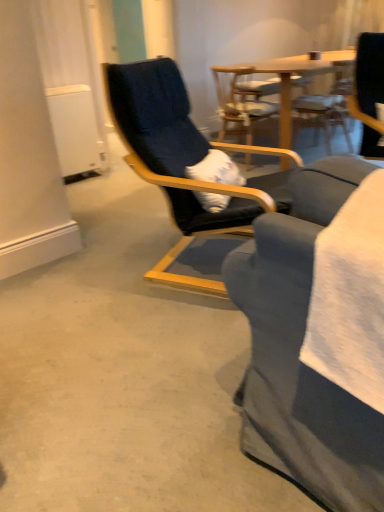
Question: Looking at their shapes, would you say wooden chair at center, the 1th chair in the back-to-front sequence, is wider or thinner than wooden chair at center, positioned as the 2th chair in back-to-front order?

Choices:
 (A) thin
 (B) wide

Answer: (A)

Question: From the image's perspective, is wooden chair at center, arranged as the third chair when viewed from the front, above or below wooden chair at center, positioned as the 2th chair in back-to-front order?

Choices:
 (A) above
 (B) below

Answer: (A)

Question: Which is farther from the wooden chair at center, positioned as the 2th chair in back-to-front order?

Choices:
 (A) wooden chair at center, arranged as the third chair when viewed from the front
 (B) black fabric chair at center, positioned as the first chair in front-to-back order

Answer: (B)

Question: Estimate the real-world distances between objects in this image. Which object is farther from the wooden chair at center, positioned as the 2th chair in back-to-front order?

Choices:
 (A) wooden chair at center, arranged as the third chair when viewed from the front
 (B) black fabric chair at center, acting as the 3th chair starting from the back

Answer: (B)